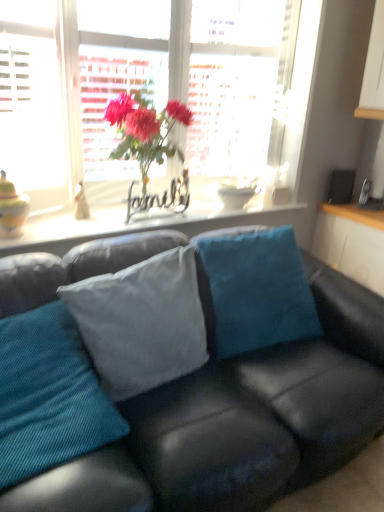
Question: Can you confirm if light blue fabric pillow at center, marked as the second pillow in a left-to-right arrangement, is smaller than white glossy cabinet at right?

Choices:
 (A) yes
 (B) no

Answer: (A)

Question: Would you say white glossy cabinet at right is part of light blue fabric pillow at center, positioned as the second pillow in right-to-left order,'s contents?

Choices:
 (A) no
 (B) yes

Answer: (A)

Question: Is light blue fabric pillow at center, positioned as the second pillow in right-to-left order, positioned far away from white glossy cabinet at right?

Choices:
 (A) yes
 (B) no

Answer: (A)

Question: Is light blue fabric pillow at center, positioned as the second pillow in right-to-left order, positioned before white glossy cabinet at right?

Choices:
 (A) yes
 (B) no

Answer: (A)

Question: Does light blue fabric pillow at center, positioned as the second pillow in right-to-left order, appear on the left side of white glossy cabinet at right?

Choices:
 (A) no
 (B) yes

Answer: (B)

Question: Choose the correct answer: Is matte glass vase at center inside matte glass window sill at center or outside it?

Choices:
 (A) outside
 (B) inside

Answer: (A)

Question: From the image's perspective, relative to matte glass window sill at center, is matte glass vase at center above or below?

Choices:
 (A) below
 (B) above

Answer: (B)

Question: Considering the positions of matte glass vase at center and matte glass window sill at center in the image, is matte glass vase at center taller or shorter than matte glass window sill at center?

Choices:
 (A) short
 (B) tall

Answer: (B)

Question: Looking at their shapes, would you say matte glass vase at center is wider or thinner than matte glass window sill at center?

Choices:
 (A) wide
 (B) thin

Answer: (B)

Question: In the image, is matte glass window at upper center on the left side or the right side of white glossy cabinet at right?

Choices:
 (A) left
 (B) right

Answer: (A)

Question: Considering the positions of point (36, 109) and point (364, 263), is point (36, 109) closer or farther from the camera than point (364, 263)?

Choices:
 (A) farther
 (B) closer

Answer: (B)

Question: From the image's perspective, is matte glass window at upper center above or below white glossy cabinet at right?

Choices:
 (A) above
 (B) below

Answer: (A)

Question: Considering the positions of matte glass window at upper center and white glossy cabinet at right in the image, is matte glass window at upper center taller or shorter than white glossy cabinet at right?

Choices:
 (A) tall
 (B) short

Answer: (A)

Question: Choose the correct answer: Is teal corduroy pillow at center, which is counted as the 1th pillow, starting from the right, inside matte glass window at upper center or outside it?

Choices:
 (A) outside
 (B) inside

Answer: (A)

Question: Is teal corduroy pillow at center, acting as the 3th pillow starting from the left, taller or shorter than matte glass window at upper center?

Choices:
 (A) tall
 (B) short

Answer: (B)